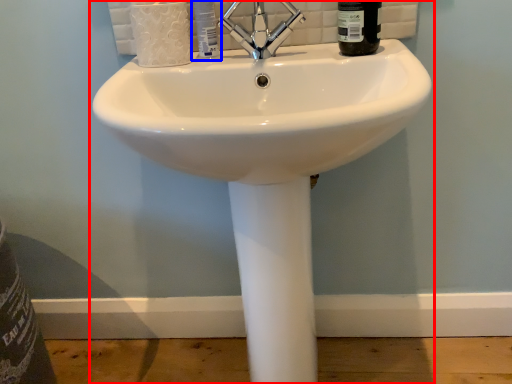
Question: Among these objects, which one is farthest to the camera, sink (highlighted by a red box) or toiletry (highlighted by a blue box)?

Choices:
 (A) sink
 (B) toiletry

Answer: (B)